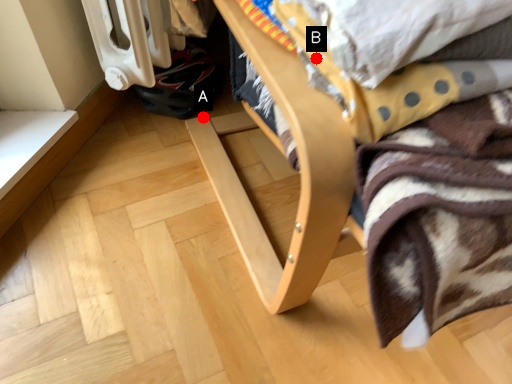
Question: Two points are circled on the image, labeled by A and B beside each circle. Which point is closer to the camera?

Choices:
 (A) A is closer
 (B) B is closer

Answer: (B)